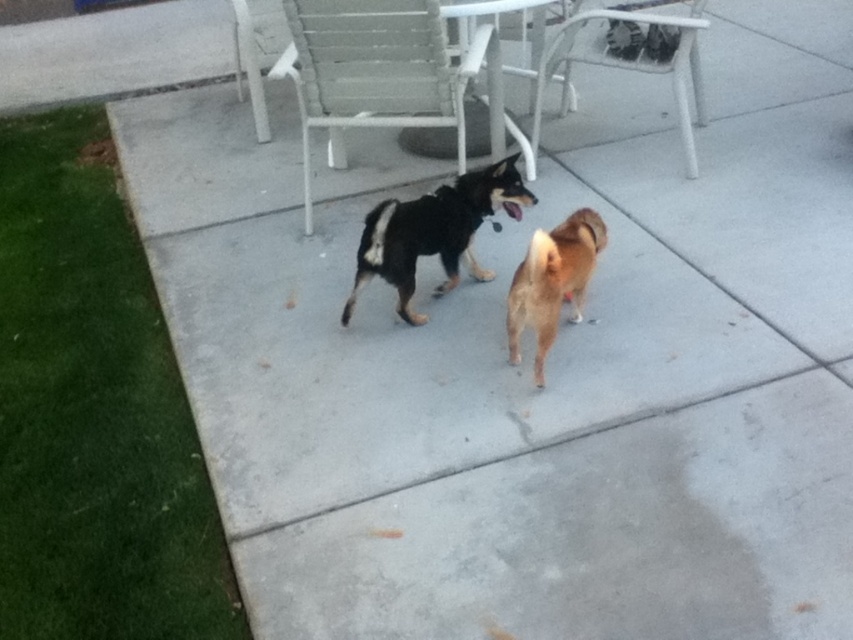
Question: In this image, where is white plastic chair at center located relative to golden brown fur at center?

Choices:
 (A) left
 (B) right

Answer: (A)

Question: Which point is farther from the camera taking this photo?

Choices:
 (A) pyautogui.click(x=585, y=243)
 (B) pyautogui.click(x=688, y=35)
 (C) pyautogui.click(x=402, y=292)

Answer: (B)

Question: Estimate the real-world distances between objects in this image. Which object is closer to the white plastic chair at upper center?

Choices:
 (A) black fur dog at center
 (B) white plastic chair at center
 (C) golden brown fur at center

Answer: (B)

Question: Can you confirm if black fur dog at center is positioned below white plastic chair at upper center?

Choices:
 (A) no
 (B) yes

Answer: (B)

Question: Which object is the closest to the white plastic chair at center?

Choices:
 (A) white plastic chair at upper center
 (B) golden brown fur at center
 (C) black fur dog at center

Answer: (C)

Question: In this image, where is black fur dog at center located relative to white plastic chair at upper center?

Choices:
 (A) left
 (B) right

Answer: (A)